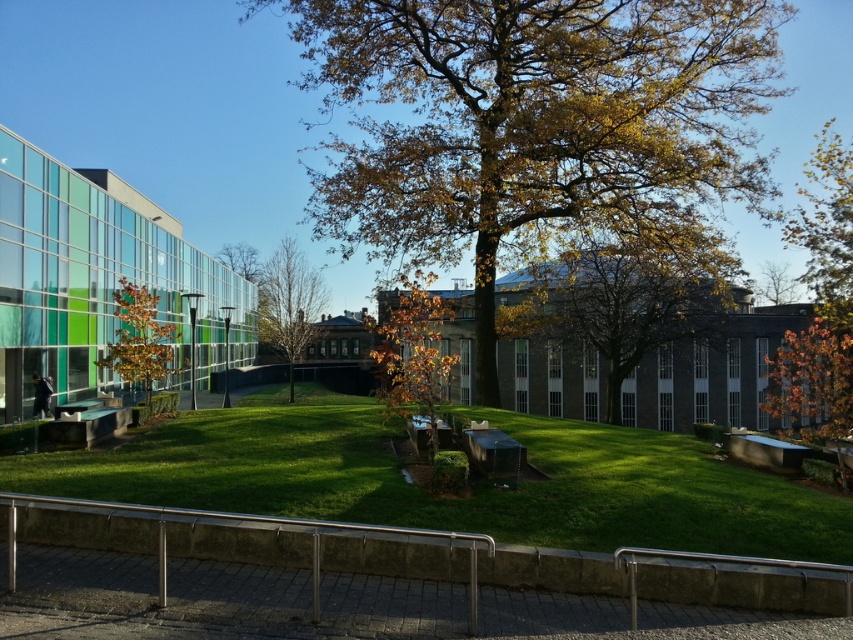
Based on the provided scene, where is the golden leafy tree at upper right located in terms of coordinates?

The golden leafy tree at upper right is located at coordinates point (827, 228).